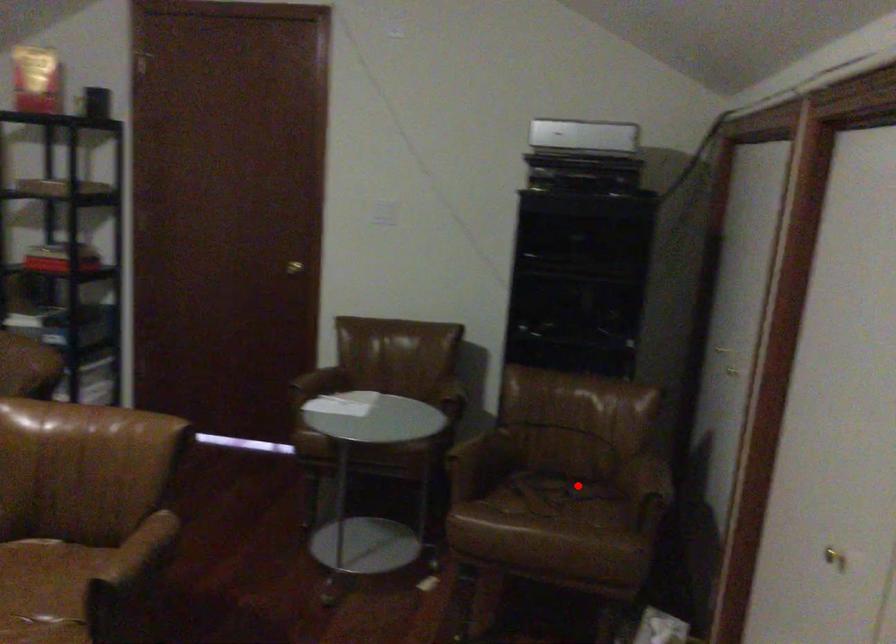
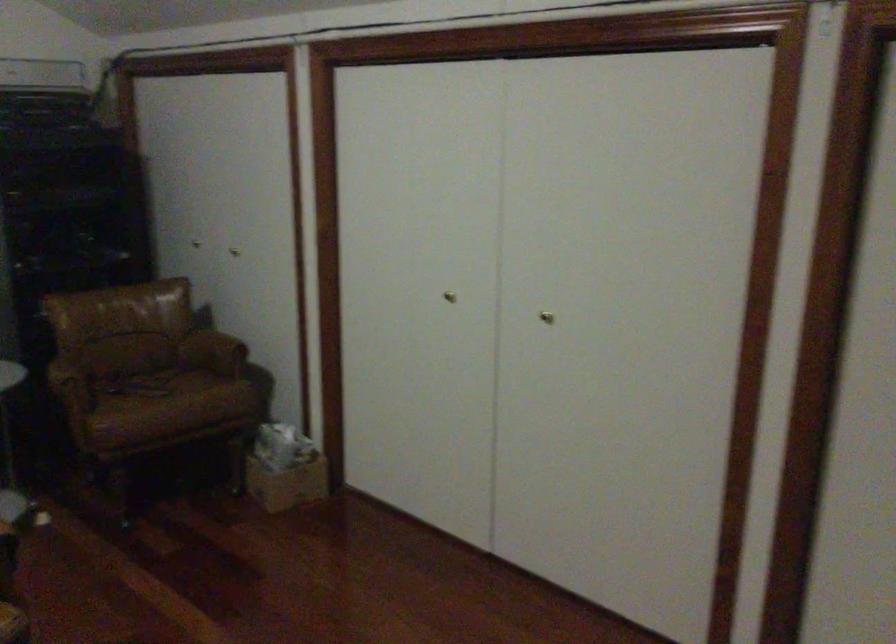
Question: A red point is marked in image1. In image2, is the corresponding 3D point closer to the camera or farther? Reply with the corresponding letter.

Choices:
 (A) The corresponding 3D point is closer.
 (B) The corresponding 3D point is farther.

Answer: (B)